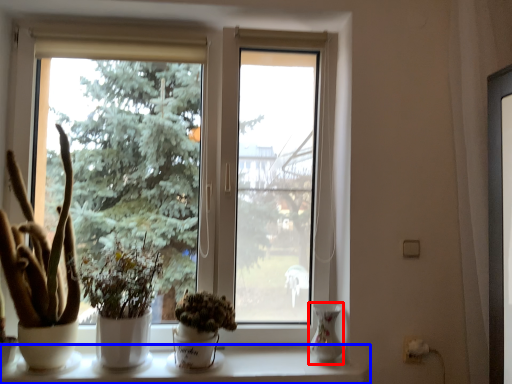
Question: Among these objects, which one is nearest to the camera, glass vase (highlighted by a red box) or window sill (highlighted by a blue box)?

Choices:
 (A) glass vase
 (B) window sill

Answer: (B)